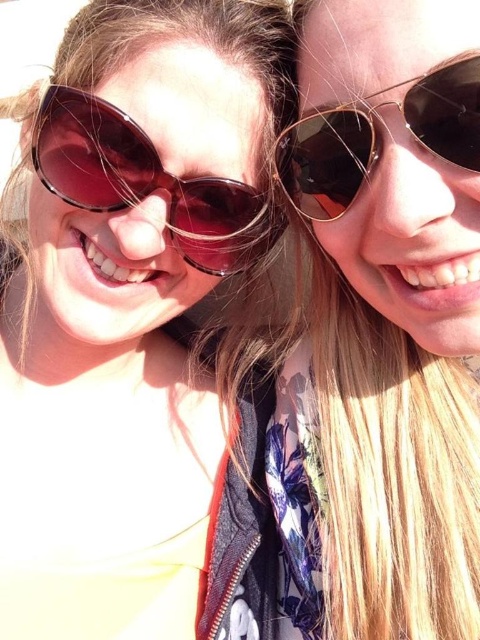
Who is shorter, matte black sunglasses at right or gold metallic sunglasses at upper right?

With less height is gold metallic sunglasses at upper right.

This screenshot has height=640, width=480. What do you see at coordinates (372, 326) in the screenshot? I see `matte black sunglasses at right` at bounding box center [372, 326].

At what (x,y) coordinates should I click in order to perform the action: click on matte black sunglasses at right. Please return your answer as a coordinate pair (x, y). Looking at the image, I should click on (372, 326).

Is matte black sunglasses at upper left bigger than gold metallic sunglasses at upper right?

Yes.

Is matte black sunglasses at upper left to the right of gold metallic sunglasses at upper right from the viewer's perspective?

Incorrect, matte black sunglasses at upper left is not on the right side of gold metallic sunglasses at upper right.

At what (x,y) coordinates should I click in order to perform the action: click on matte black sunglasses at upper left. Please return your answer as a coordinate pair (x, y). The image size is (480, 640). Looking at the image, I should click on (137, 326).

Where is `matte black sunglasses at upper left`? This screenshot has height=640, width=480. matte black sunglasses at upper left is located at coordinates (137, 326).

How distant is matte black sunglasses at upper left from matte brown sunglasses at left?

A distance of 5.92 inches exists between matte black sunglasses at upper left and matte brown sunglasses at left.

Is matte black sunglasses at upper left below matte brown sunglasses at left?

Yes, matte black sunglasses at upper left is below matte brown sunglasses at left.

The width and height of the screenshot is (480, 640). In order to click on matte black sunglasses at upper left in this screenshot , I will do pyautogui.click(x=137, y=326).

Find the location of a particular element. matte black sunglasses at upper left is located at coordinates (137, 326).